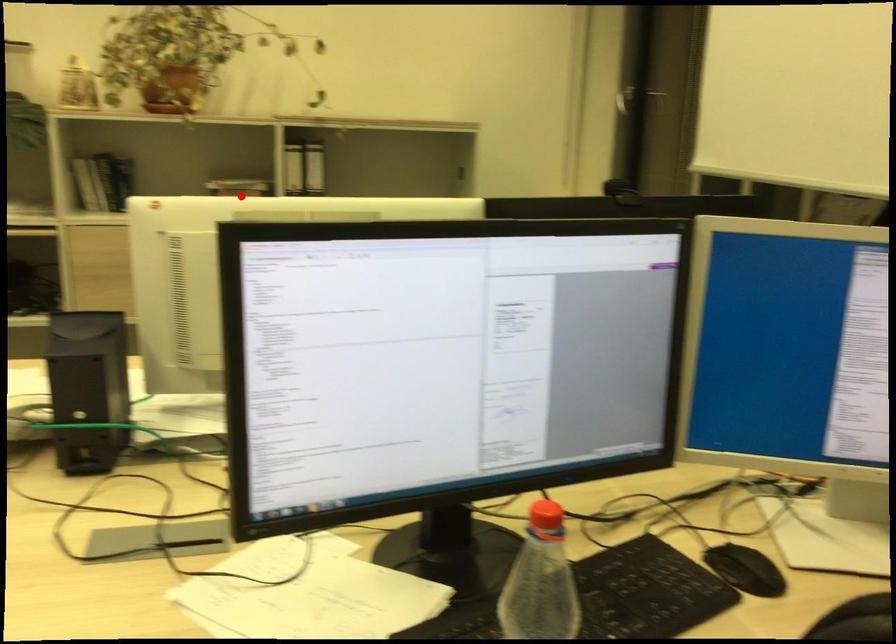
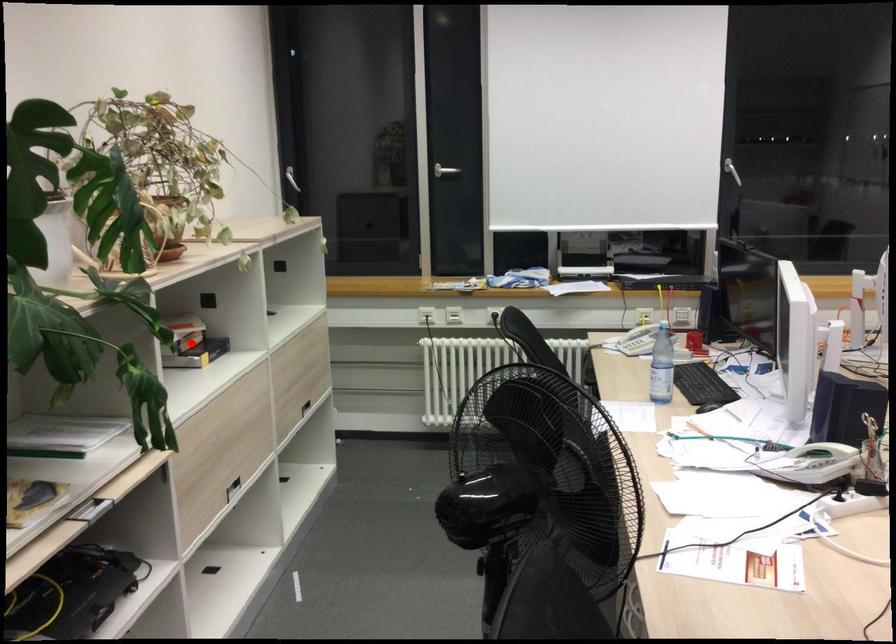
I am providing you with two images of the same scene from different viewpoints. A red point is marked on the first image and another point is marked on the second image. Is the red point in image1 aligned with the point shown in image2?

Yes